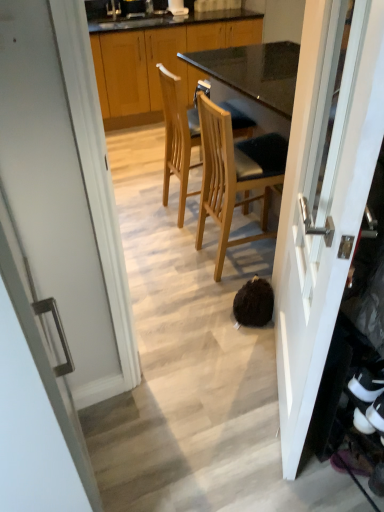
You are a GUI agent. You are given a task and a screenshot of the screen. Output one action in this format:
    pyautogui.click(x=<x>, y=<y>)
    Task: Click on the vacant space situated on the left part of wooden chair at center, which appears as the 2th chair when viewed from the back
    
    Given the screenshot: What is the action you would take?
    pyautogui.click(x=175, y=258)